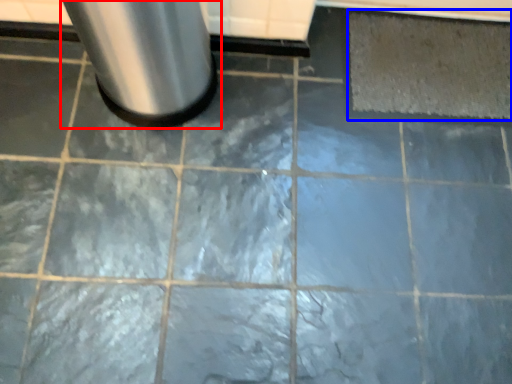
Question: Among these objects, which one is farthest to the camera, waste container (highlighted by a red box) or mat (highlighted by a blue box)?

Choices:
 (A) waste container
 (B) mat

Answer: (B)